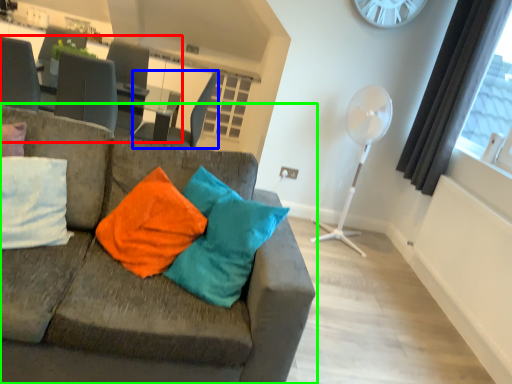
Question: Which object is the farthest from table (highlighted by a red box)? Choose among these: swivel chair (highlighted by a blue box) or studio couch (highlighted by a green box).

Choices:
 (A) swivel chair
 (B) studio couch

Answer: (B)